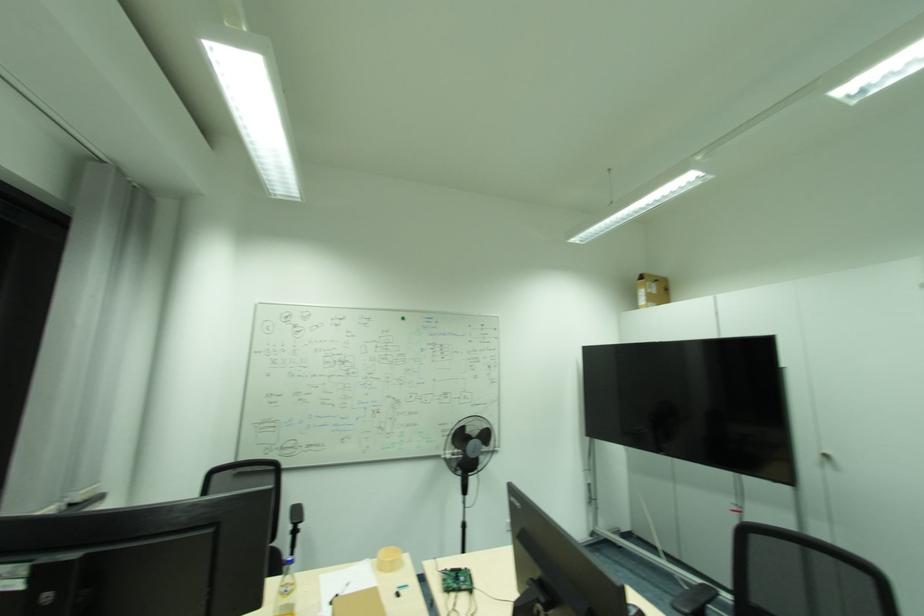
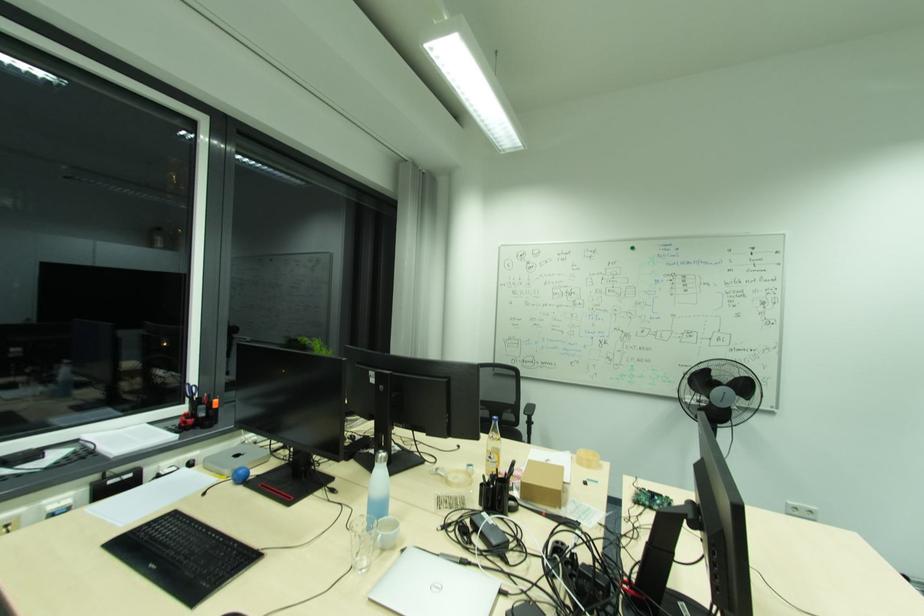
Locate, in the second image, the point that corresponds to pixel 491 436 in the first image.

(748, 387)